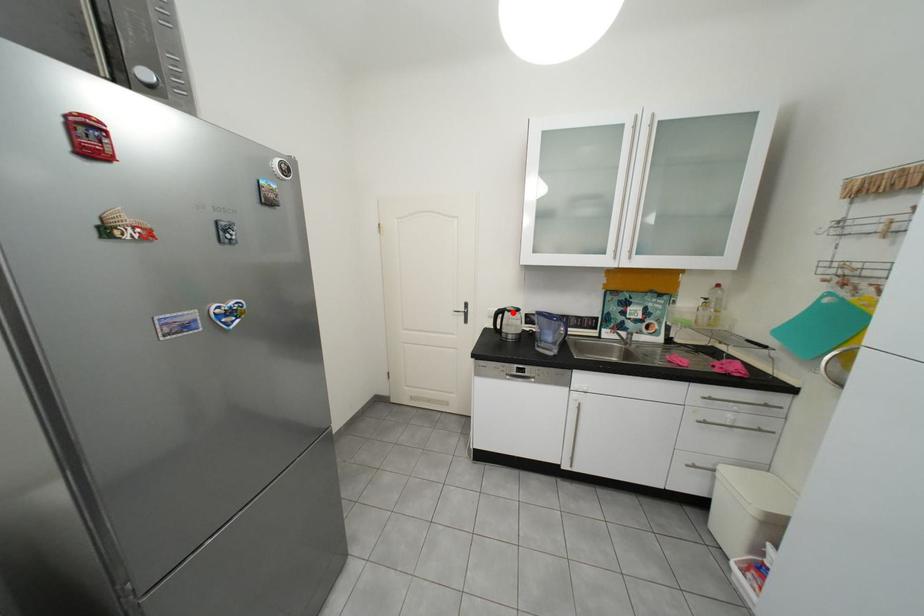
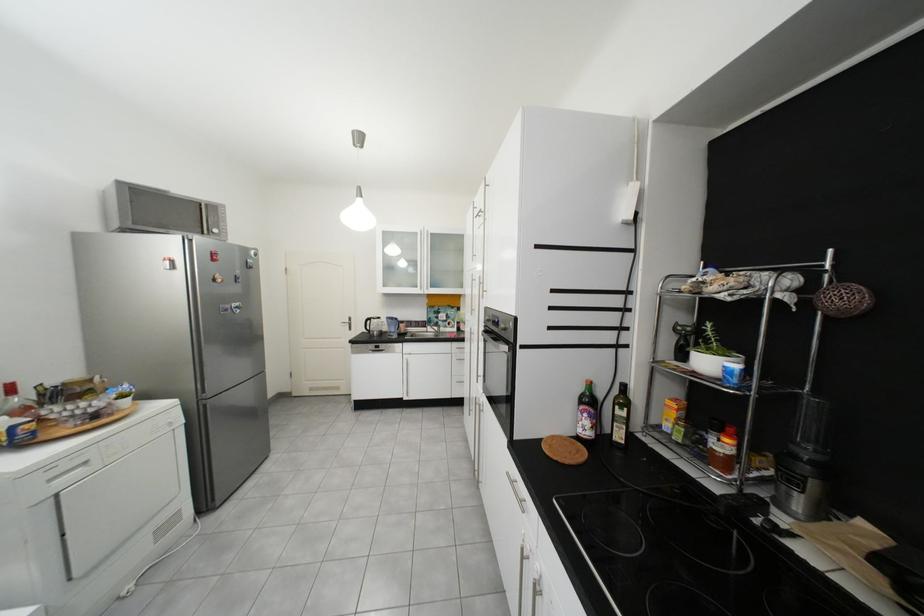
The point at the highlighted location is marked in the first image. Where is the corresponding point in the second image?

(381, 321)